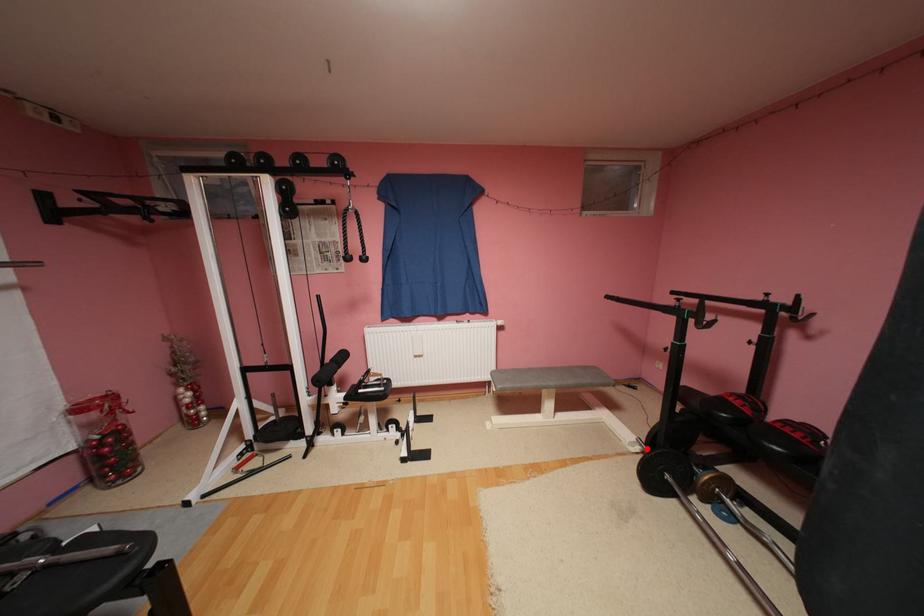
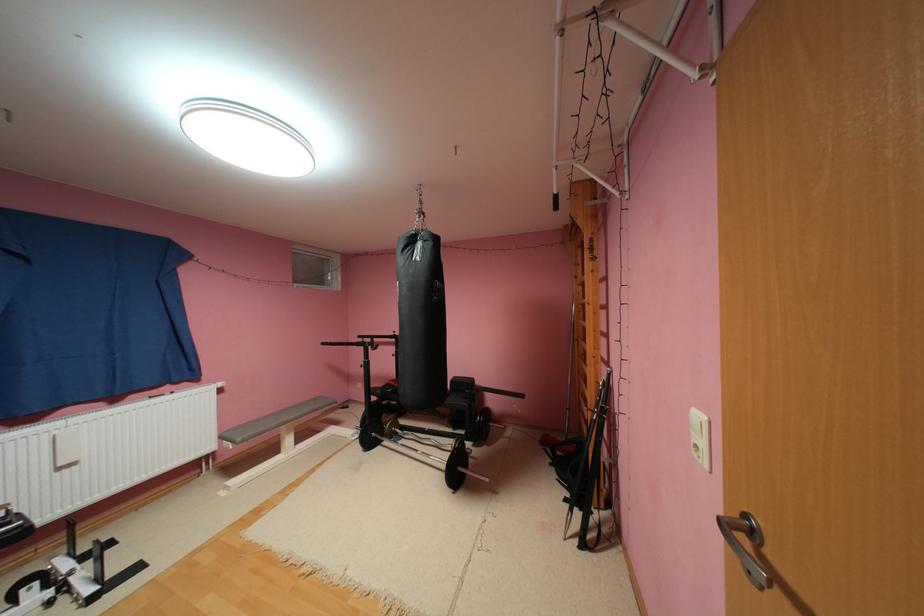
Question: I am providing you with two images of the same scene from different viewpoints. Given a red point in image1, look at the same physical point in image2. Is it:

Choices:
 (A) Closer to the viewpoint
 (B) Farther from the viewpoint

Answer: (B)